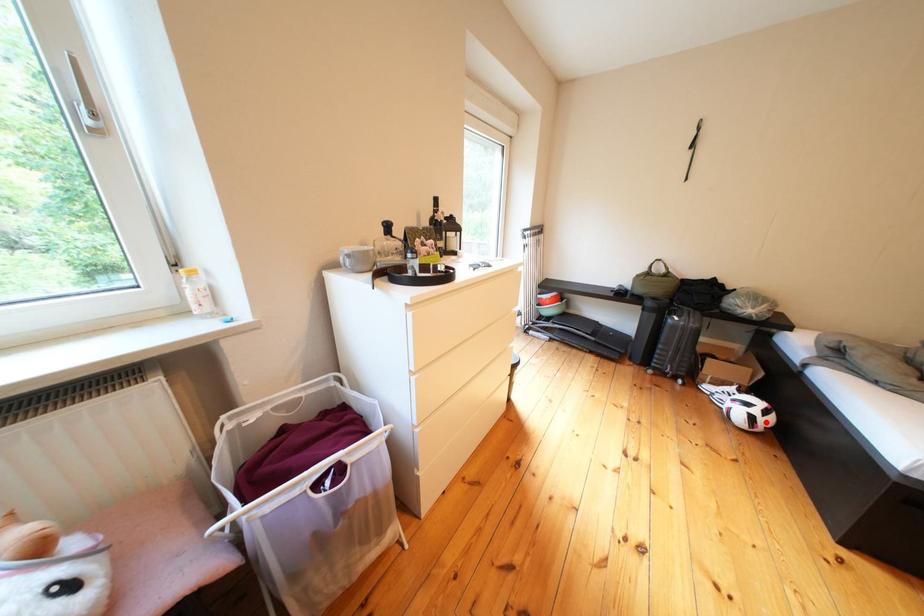
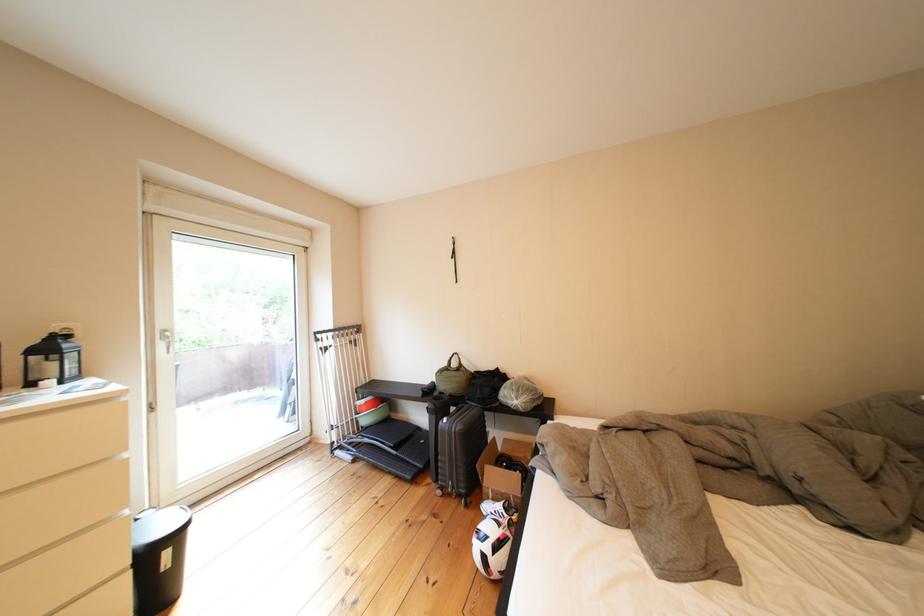
Question: A red point is marked in image1. In image2, is the corresponding 3D point closer to the camera or farther? Reply with the corresponding letter.

Choices:
 (A) The corresponding 3D point is closer.
 (B) The corresponding 3D point is farther.

Answer: (B)